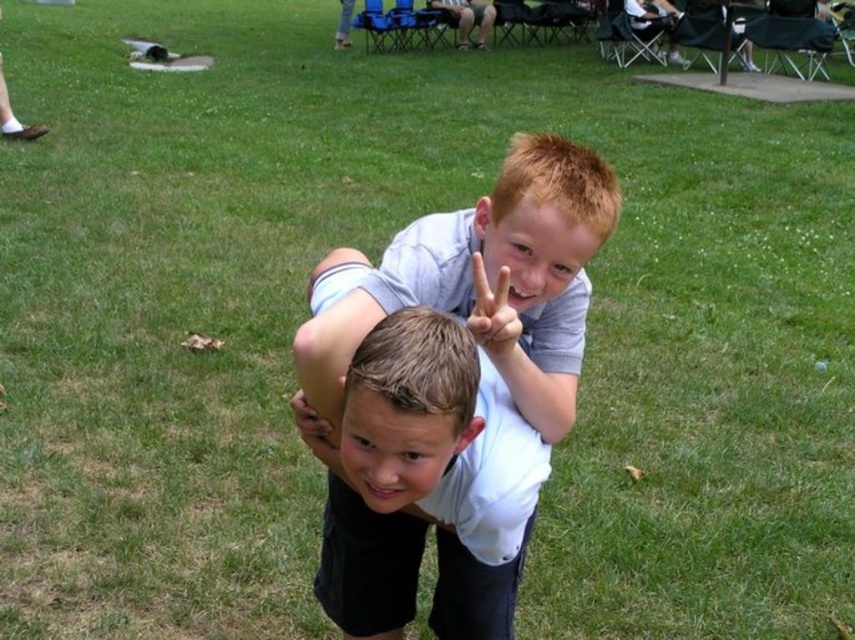
You are standing in the grassy field and see two points marked in the image. Which point is closer to you, point (531, 177) or point (323, 422)?

Point (531, 177) is closer to the viewer than point (323, 422).

You are a photographer trying to capture the perfect shot of the two boys in the scene. The blonde hair at center and smooth brown hand at center are both in focus. Which object would appear bigger in your photo?

The blonde hair at center would appear bigger in the photo since it has a larger size compared to the smooth brown hand at center.